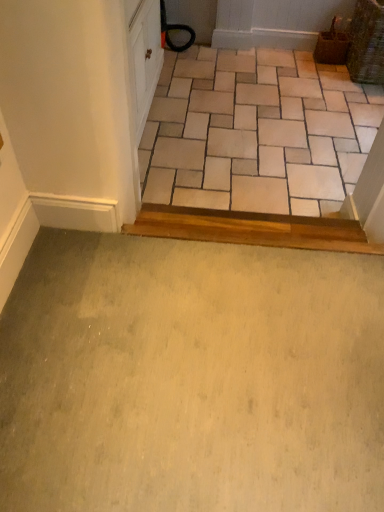
Question: Is beige ceramic tile at upper center touching green carpet at lower center?

Choices:
 (A) no
 (B) yes

Answer: (A)

Question: Considering the relative sizes of beige ceramic tile at upper center and green carpet at lower center in the image provided, is beige ceramic tile at upper center taller than green carpet at lower center?

Choices:
 (A) yes
 (B) no

Answer: (A)

Question: Does beige ceramic tile at upper center have a lesser width compared to green carpet at lower center?

Choices:
 (A) no
 (B) yes

Answer: (A)

Question: Is beige ceramic tile at upper center further to camera compared to green carpet at lower center?

Choices:
 (A) yes
 (B) no

Answer: (A)

Question: Does beige ceramic tile at upper center appear on the right side of green carpet at lower center?

Choices:
 (A) no
 (B) yes

Answer: (B)

Question: From the image's perspective, does beige ceramic tile at upper center appear higher than green carpet at lower center?

Choices:
 (A) yes
 (B) no

Answer: (A)

Question: Can you confirm if green carpet at lower center is positioned to the left of beige ceramic tile at upper center?

Choices:
 (A) no
 (B) yes

Answer: (B)

Question: Is green carpet at lower center next to beige ceramic tile at upper center?

Choices:
 (A) yes
 (B) no

Answer: (B)

Question: Does green carpet at lower center contain beige ceramic tile at upper center?

Choices:
 (A) no
 (B) yes

Answer: (A)

Question: Is green carpet at lower center far away from beige ceramic tile at upper center?

Choices:
 (A) no
 (B) yes

Answer: (B)

Question: From a real-world perspective, is green carpet at lower center positioned under beige ceramic tile at upper center based on gravity?

Choices:
 (A) yes
 (B) no

Answer: (B)

Question: Can you confirm if green carpet at lower center is taller than beige ceramic tile at upper center?

Choices:
 (A) yes
 (B) no

Answer: (B)

Question: Is beige ceramic tile at upper center in front of or behind green carpet at lower center in the image?

Choices:
 (A) front
 (B) behind

Answer: (B)